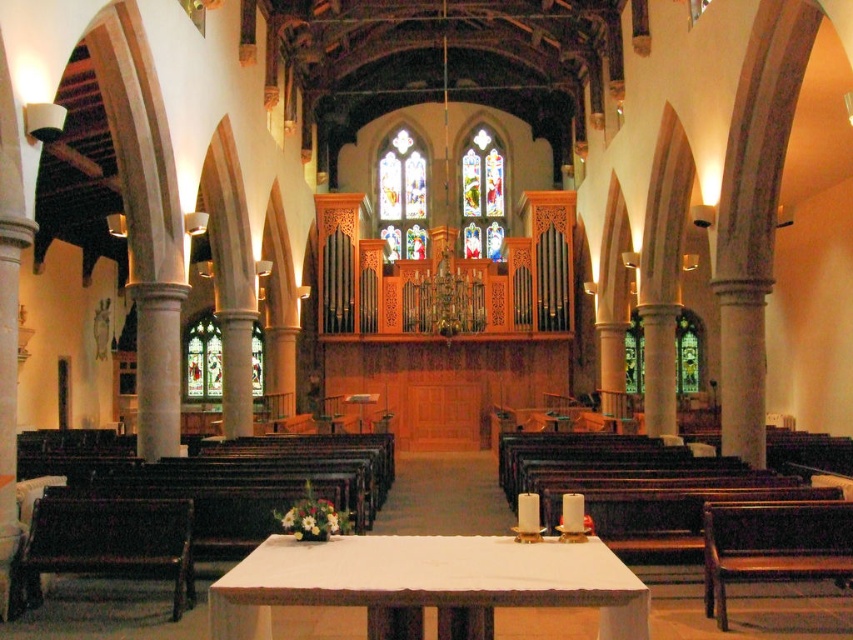
Question: Can you confirm if white cloth-covered table at center is positioned above brown wooden bench at lower right?

Choices:
 (A) yes
 (B) no

Answer: (B)

Question: Which point is farther from the camera taking this photo?

Choices:
 (A) (399, 148)
 (B) (473, 195)

Answer: (A)

Question: In this image, where is white cloth-covered table at center located relative to dark brown polished wood bench at lower left?

Choices:
 (A) above
 (B) below

Answer: (B)

Question: Is dark brown polished wood bench at lower left to the left of stained glass window at left from the viewer's perspective?

Choices:
 (A) no
 (B) yes

Answer: (A)

Question: Which object is farther from the camera taking this photo?

Choices:
 (A) stained glass window at left
 (B) dark brown polished wood bench at lower left
 (C) stained glass window at center

Answer: (C)

Question: Considering the real-world distances, which object is farthest from the dark brown polished wood bench at lower left?

Choices:
 (A) white cloth-covered table at center
 (B) stained glass window at left

Answer: (B)